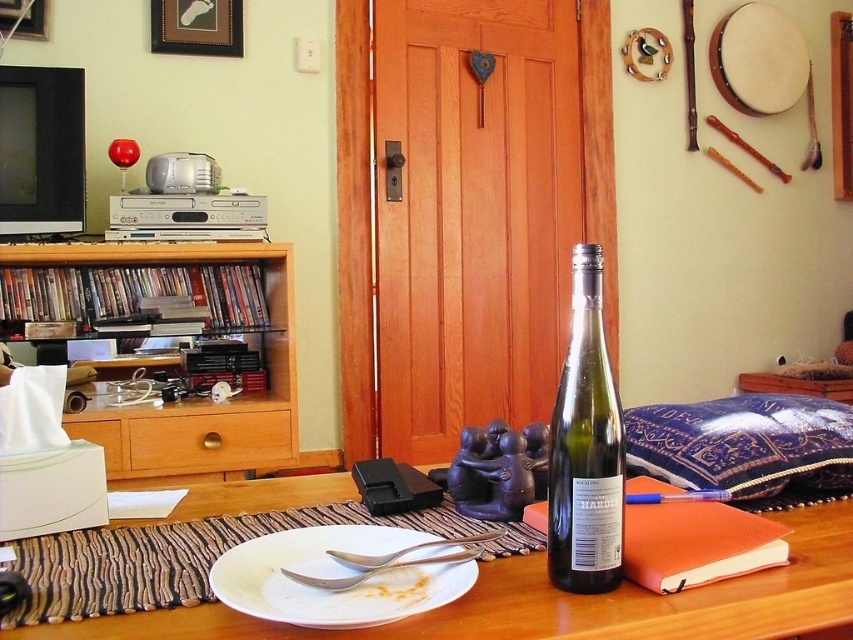
You are standing in the living room and want to pick up the silver metallic spoon at lower center. Which item on the wooden table is closest to the point marked at coordinates (405, 550)?

The point at coordinates (405, 550) corresponds to the silver metallic spoon at lower center, so the closest item is the silver metallic spoon at lower center itself.

You are organizing a dinner party and need to place a 15 cm tall candle holder on the table. The wooden drawer at center and the satin silver spoon at center are already present. Which object can accommodate the candle holder in terms of height?

The wooden drawer at center is much taller than the satin silver spoon at center, so the candle holder can be placed on top of the wooden drawer at center since it has sufficient height.